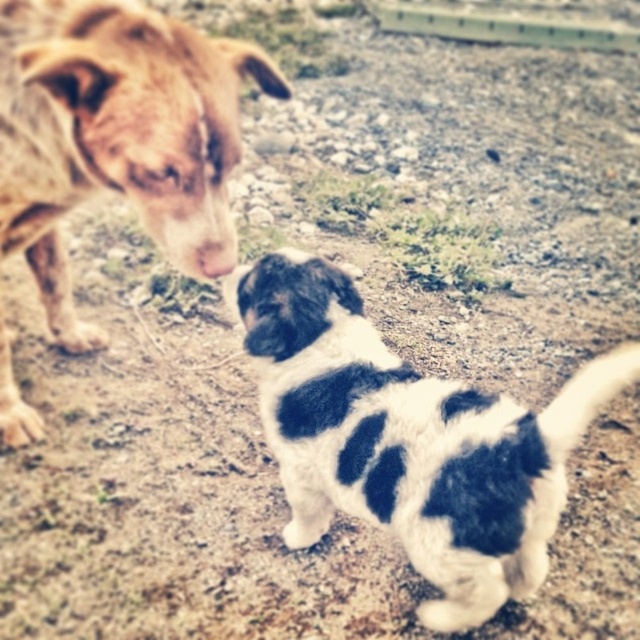
Question: Which point is closer to the camera?

Choices:
 (A) (189, 68)
 (B) (404, 497)

Answer: (A)

Question: Among these objects, which one is nearest to the camera?

Choices:
 (A) brown speckled fur at left
 (B) black and white fur at center

Answer: (B)

Question: Does black and white fur at center appear on the left side of brown speckled fur at left?

Choices:
 (A) yes
 (B) no

Answer: (B)

Question: Is black and white fur at center closer to the viewer compared to brown speckled fur at left?

Choices:
 (A) yes
 (B) no

Answer: (A)

Question: Does black and white fur at center appear under brown speckled fur at left?

Choices:
 (A) yes
 (B) no

Answer: (A)

Question: Which point is closer to the camera taking this photo?

Choices:
 (A) (19, 131)
 (B) (544, 464)

Answer: (B)